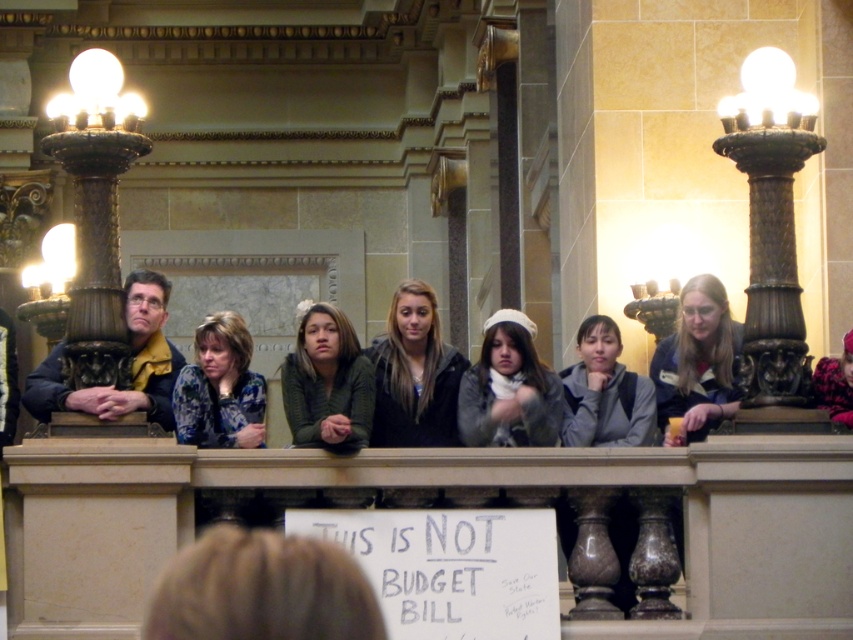
You are standing on the balcony and want to hand a note to the person wearing the green fuzzy sweater at center without disturbing the person in the dark blue jacket at left. How should you approach them?

The green fuzzy sweater at center is positioned under the dark blue jacket at left, so you should approach from the right side of the dark blue jacket at left to avoid disturbing them.

You are standing on the balcony and want to place a decorative item exactly at the center of the balcony. The white woolen hat at center is currently placed at coordinates 0.608, 0.597. Is the hat placed correctly?

The white woolen hat at center is located at coordinates (508, 388), which is the exact center point of the balcony, so the hat is placed correctly.